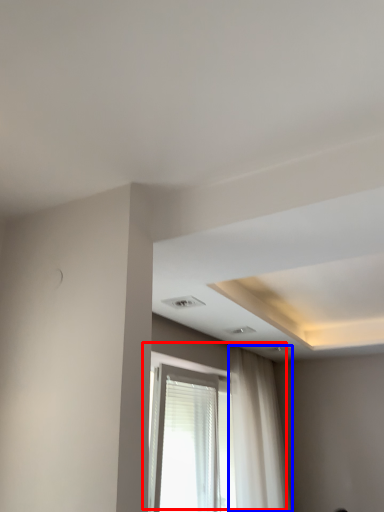
Question: Which object is closer to the camera taking this photo, window (highlighted by a red box) or curtain (highlighted by a blue box)?

Choices:
 (A) window
 (B) curtain

Answer: (A)